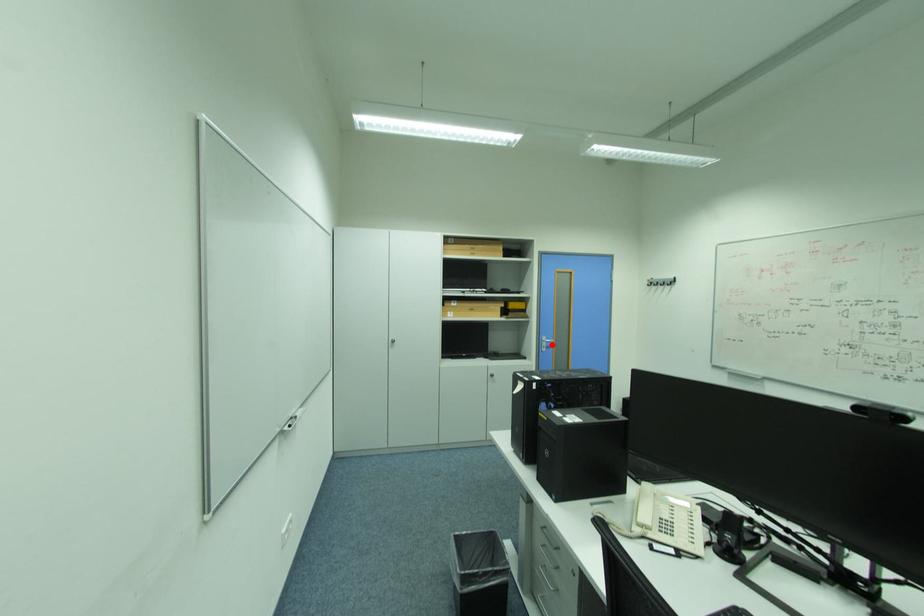
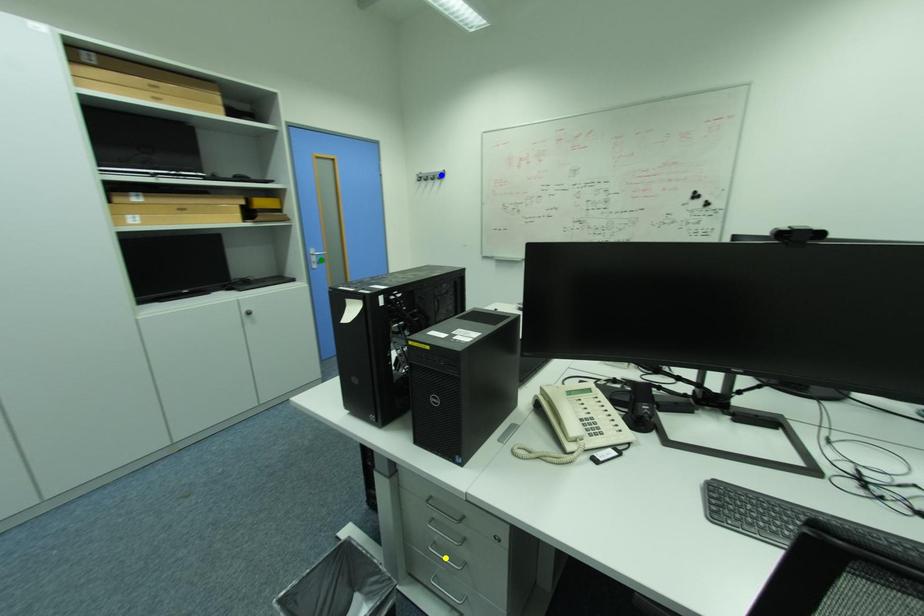
Question: I am providing you with two images of the same scene from different viewpoints. A red point is marked on the first image. You are given multiple points on the second image. Which mark in image 2 goes with the point in image 1?

Choices:
 (A) green point
 (B) blue point
 (C) yellow point

Answer: (A)